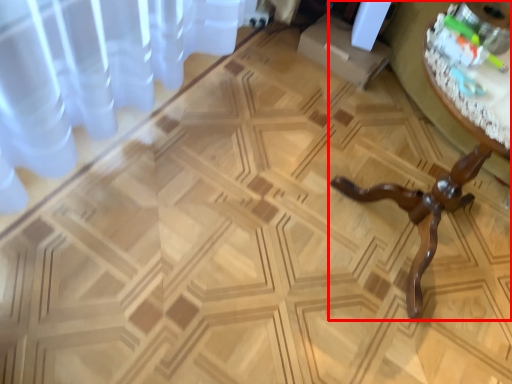
Question: From the image's perspective, what is the correct spatial positioning of table (annotated by the red box) in reference to round table?

Choices:
 (A) below
 (B) above

Answer: (A)